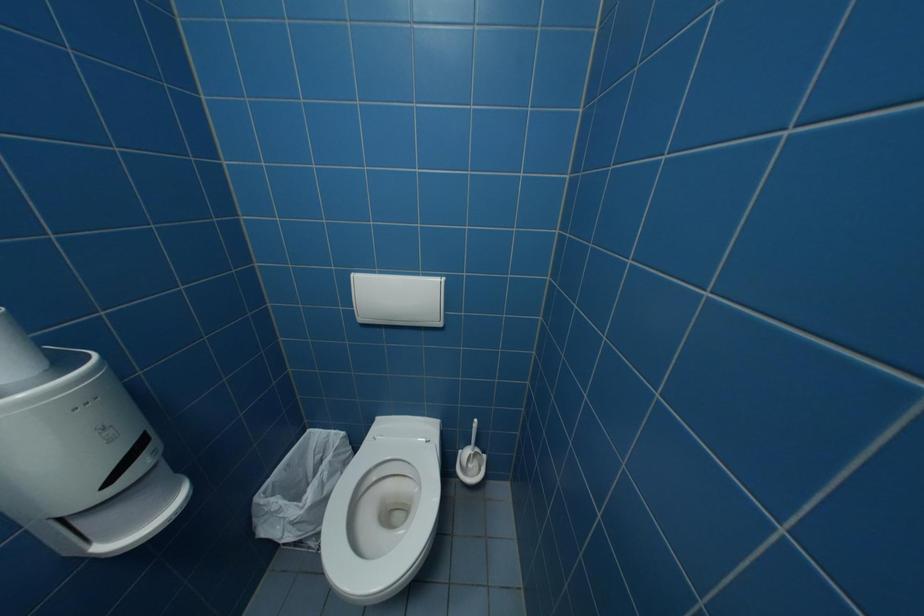
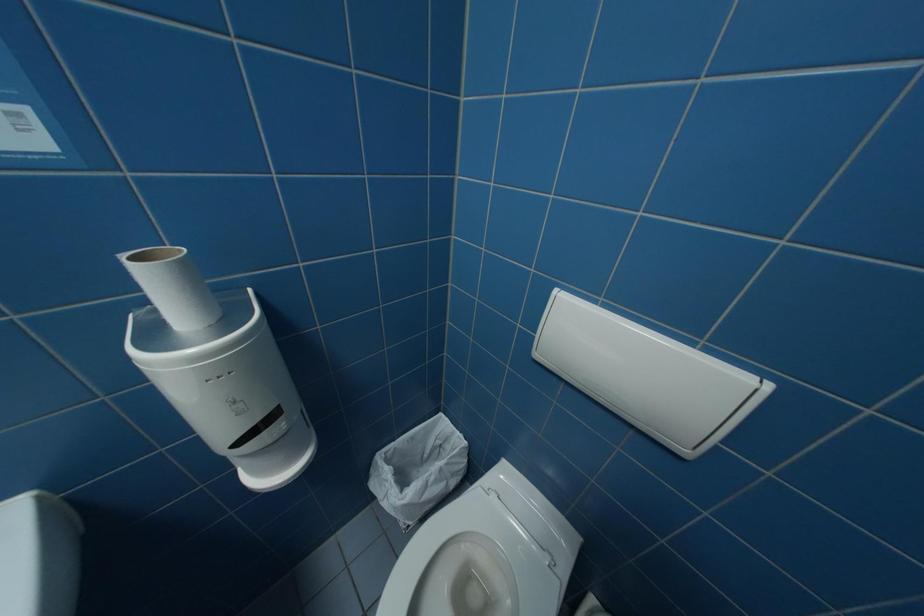
Question: The camera is either moving clockwise (left) or counter-clockwise (right) around the object. The first image is from the beginning of the video and the second image is from the end. Is the camera moving left or right when shooting the video?

Choices:
 (A) Left
 (B) Right

Answer: (B)